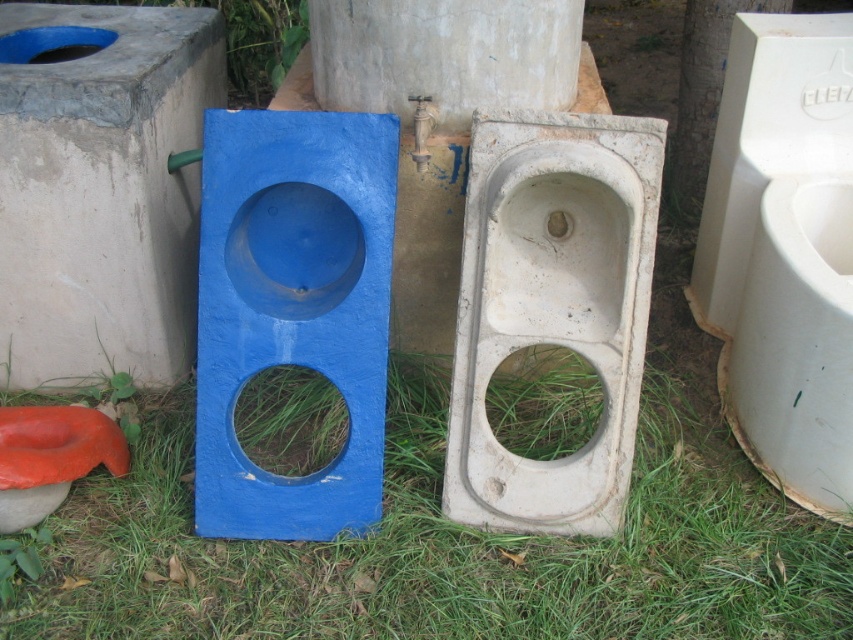
You are a construction worker trying to install a new fixture. You need to know the distance between the smooth concrete wall at left and the rubberized orange toilet bowl at lower left. Is the space between them sufficient to fit a 1.5 feet wide pipe?

The smooth concrete wall at left and the rubberized orange toilet bowl at lower left are 18.88 inches apart. Since 18.88 inches is approximately 1.57 feet, which is slightly wider than 1.5 feet, the space is sufficient to fit a 1.5 feet wide pipe.

In the scene shown: You are standing in the construction area and need to locate the smooth concrete wall at left. According to the coordinates provided, where would you find it?

The smooth concrete wall at left is located at the coordinates point (102, 189).

You are a construction worker inspecting the layout of the sanitation fixtures. You notice the smooth concrete wall at left and the white plastic urinal at right. Which object is positioned higher in the scene?

The smooth concrete wall at left is positioned higher than the white plastic urinal at right.